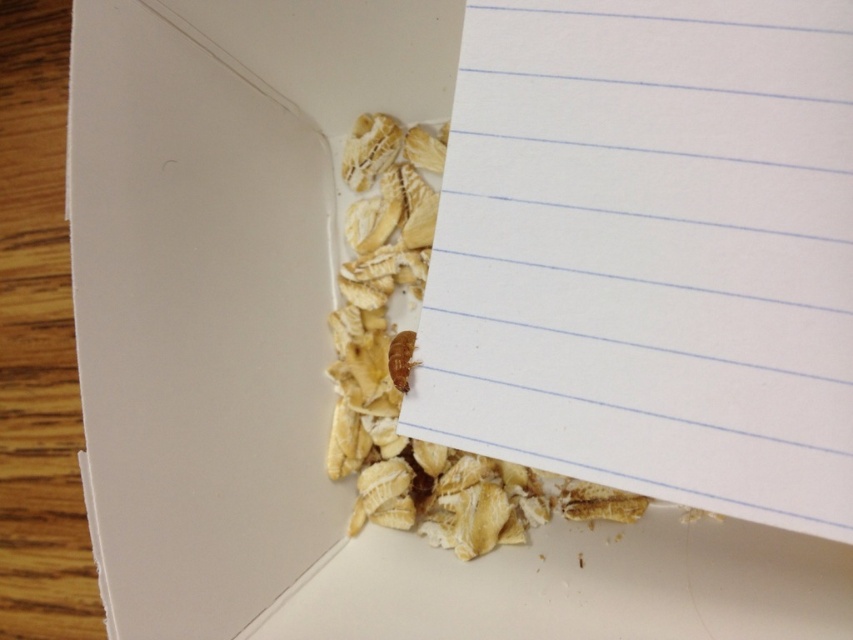
Between point (531, 512) and point (577, 556), which one is positioned in front?

Point (577, 556)

Is light brown paper at upper right thinner than brown crumb at lower center?

In fact, light brown paper at upper right might be wider than brown crumb at lower center.

Between point (444, 456) and point (583, 564), which one is positioned in front?

Point (583, 564)

Where is `light brown paper at upper right`? The image size is (853, 640). light brown paper at upper right is located at coordinates (402, 394).

Which of these two, brown matte nut at center or brown crumb at lower center, stands shorter?

brown crumb at lower center

Can you confirm if brown matte nut at center is shorter than brown crumb at lower center?

Incorrect, brown matte nut at center's height does not fall short of brown crumb at lower center's.

The width and height of the screenshot is (853, 640). Find the location of `brown matte nut at center`. brown matte nut at center is located at coordinates point(401,358).

Based on the photo, measure the distance between light brown paper at upper right and brown matte nut at center.

The distance of light brown paper at upper right from brown matte nut at center is 23.28 centimeters.

Does light brown paper at upper right have a larger size compared to brown matte nut at center?

Yes, light brown paper at upper right is bigger than brown matte nut at center.

Which is in front, point (519, 525) or point (402, 374)?

Positioned in front is point (402, 374).

At what (x,y) coordinates should I click in order to perform the action: click on light brown paper at upper right. Please return your answer as a coordinate pair (x, y). This screenshot has width=853, height=640. Looking at the image, I should click on (x=402, y=394).